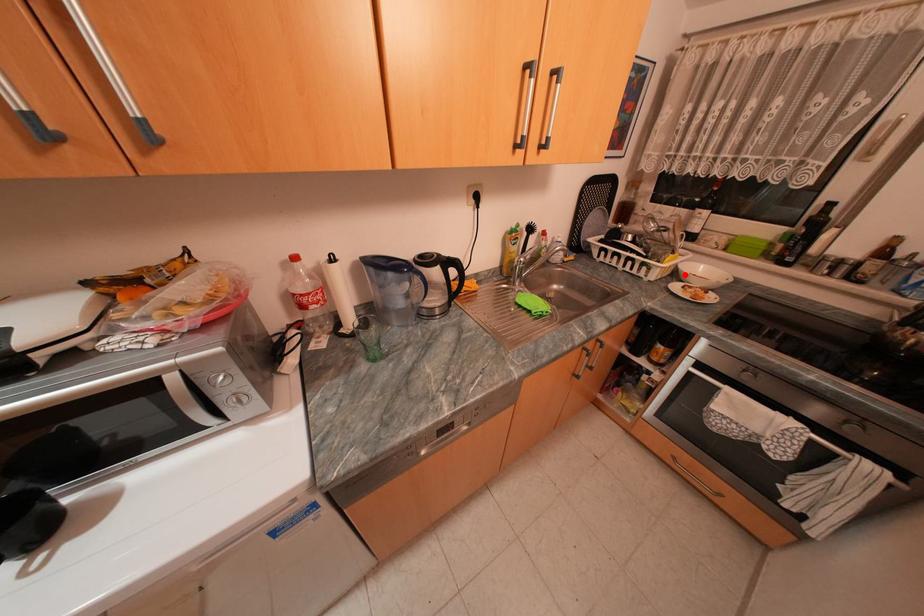
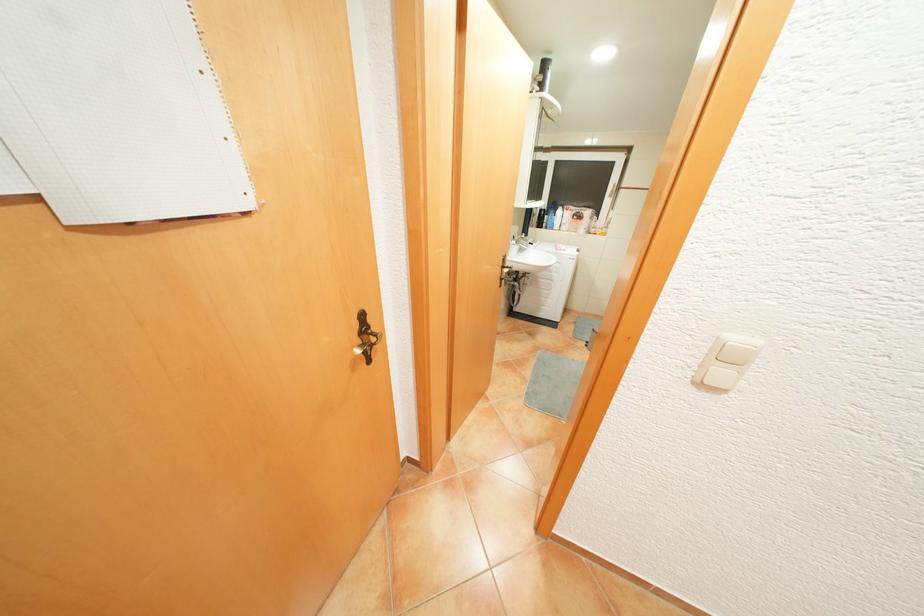
Question: I am providing you with two images of the same scene from different viewpoints. A red point is marked on the first image. Is the red point's position out of view in image 2?

Choices:
 (A) Yes
 (B) No

Answer: (A)